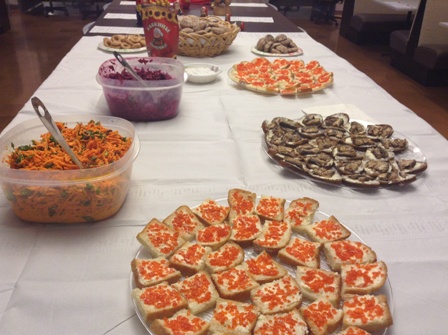
The height and width of the screenshot is (335, 448). I want to click on handle, so click(51, 123), click(118, 59).